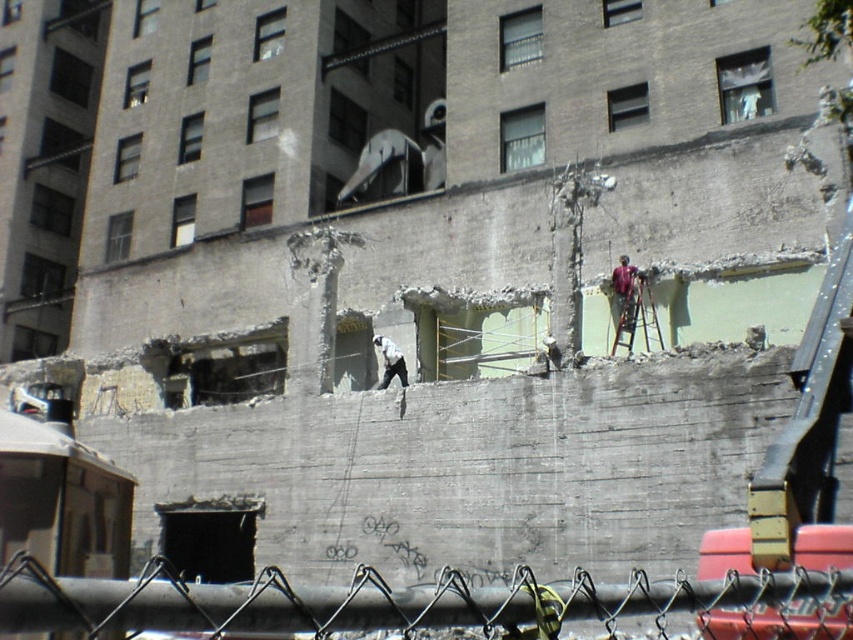
You are a safety inspector at the construction site. You notice two points marked on the site map. One is at point (329, 609) and the other at point (374, 340). According to the site map, which point is closer to the entrance of the building?

→ Point (329, 609) is in front of point (374, 340), so it is closer to the entrance of the building.